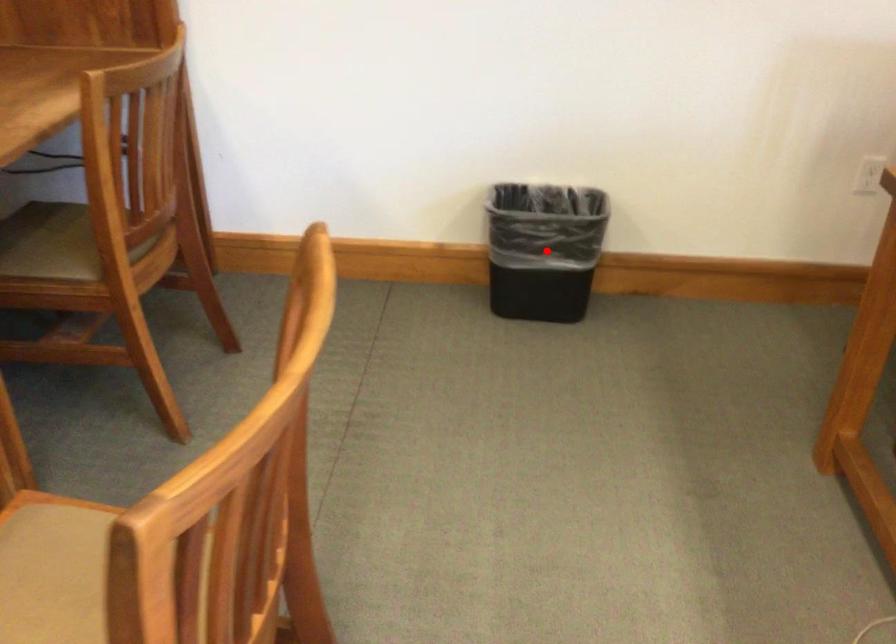
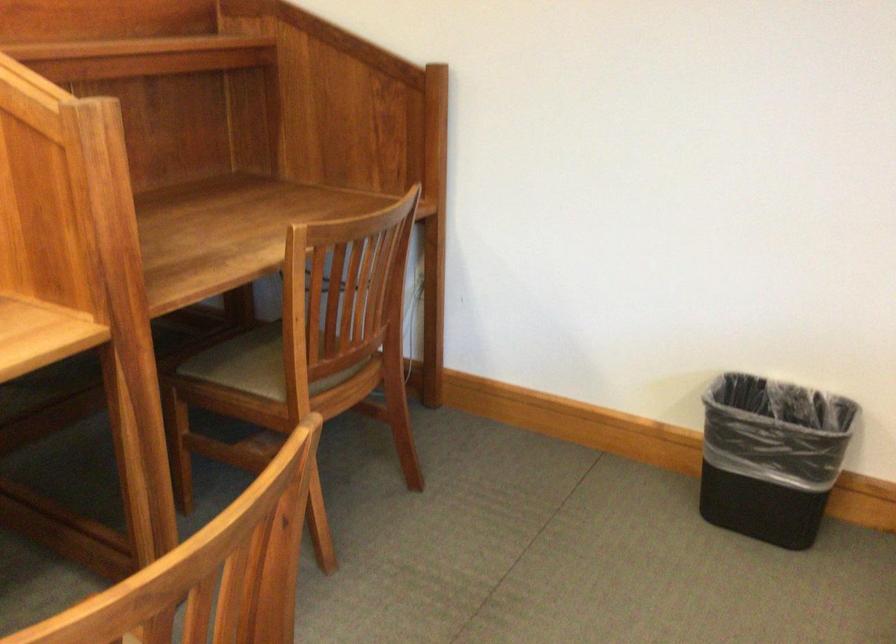
Question: I am providing you with two images of the same scene from different viewpoints. In image1, a red point is highlighted. Considering the same 3D point in image2, which of the following is correct?

Choices:
 (A) It is closer
 (B) It is farther

Answer: (A)